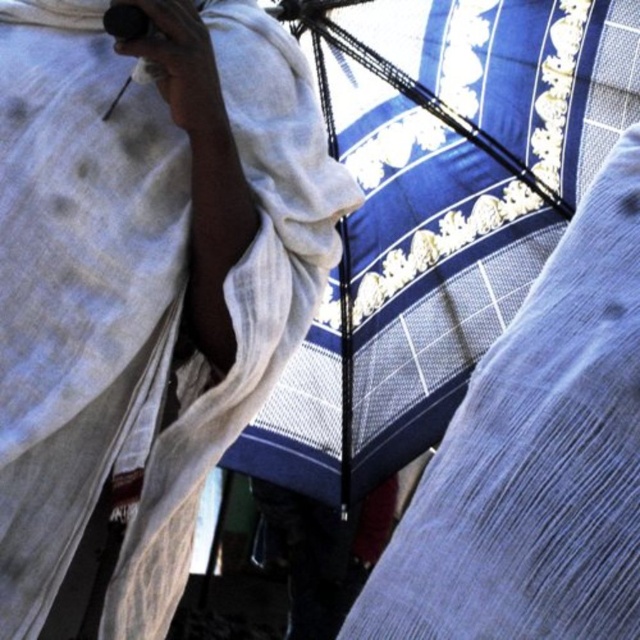
Question: Is blue woven cloth at upper right to the right of blue textured fabric at center from the viewer's perspective?

Choices:
 (A) yes
 (B) no

Answer: (B)

Question: Which object is closer to the camera taking this photo?

Choices:
 (A) blue textured fabric at center
 (B) blue woven cloth at upper right

Answer: (A)

Question: Can you confirm if blue woven cloth at upper right is thinner than blue textured fabric at center?

Choices:
 (A) yes
 (B) no

Answer: (B)

Question: Is blue woven cloth at upper right below blue textured fabric at center?

Choices:
 (A) yes
 (B) no

Answer: (B)